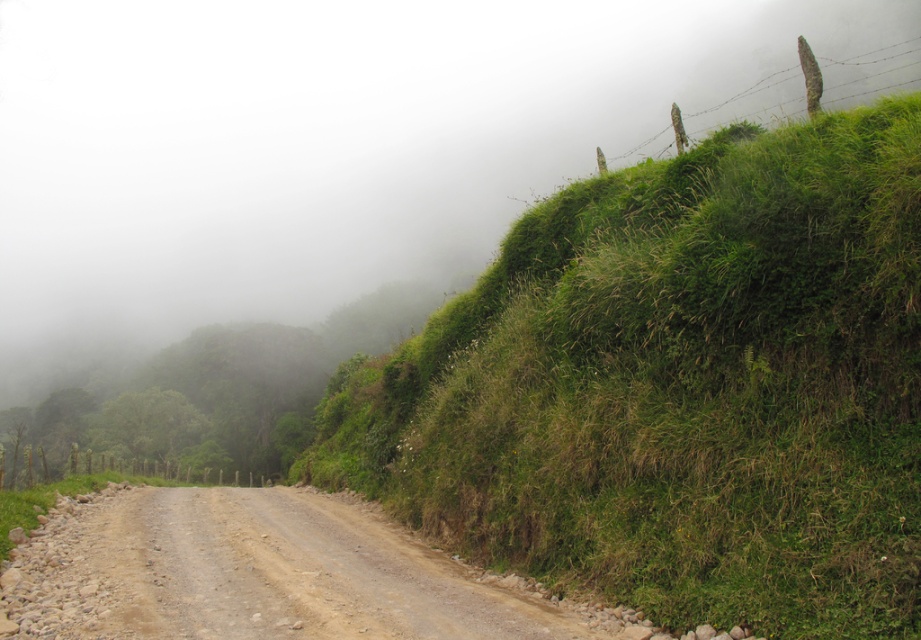
Question: Is green grassy hillside at upper right to the right of dusty gravel road at center from the viewer's perspective?

Choices:
 (A) no
 (B) yes

Answer: (B)

Question: Can you confirm if green grassy hillside at upper right is positioned to the left of dusty gravel road at center?

Choices:
 (A) no
 (B) yes

Answer: (A)

Question: Is green grassy hillside at upper right closer to camera compared to dusty gravel road at center?

Choices:
 (A) yes
 (B) no

Answer: (A)

Question: Which point appears closest to the camera in this image?

Choices:
 (A) (66, 634)
 (B) (682, 445)

Answer: (A)